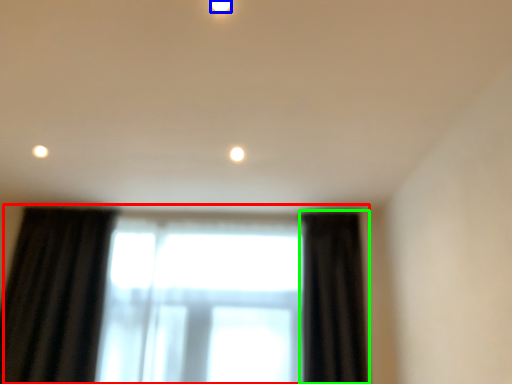
Question: Estimate the real-world distances between objects in this image. Which object is farther from window (highlighted by a red box), lighting (highlighted by a blue box) or curtain (highlighted by a green box)?

Choices:
 (A) lighting
 (B) curtain

Answer: (A)